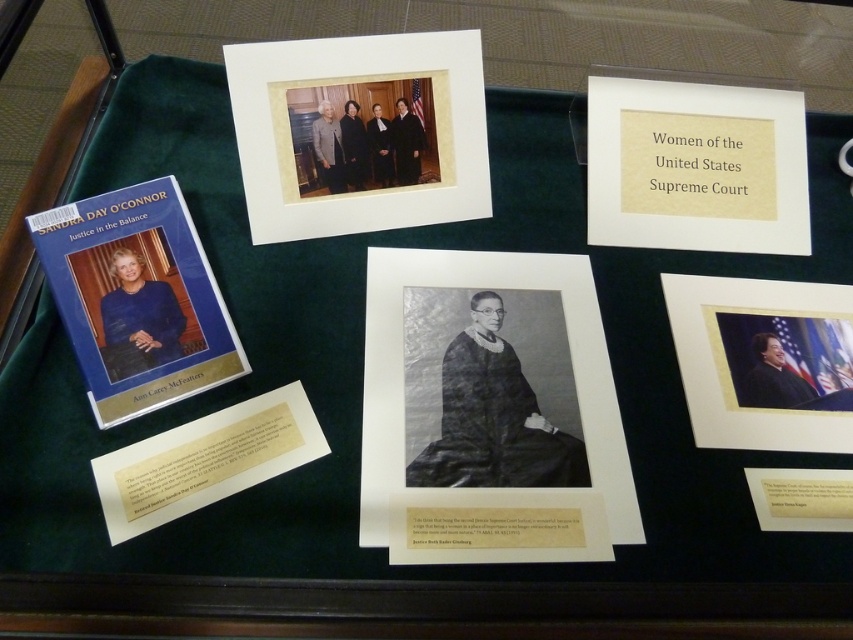
Which is in front, point (718, 230) or point (709, 380)?

Positioned in front is point (709, 380).

Based on the photo, can you confirm if beige paper at upper center is shorter than matte gold photo frame at lower right?

Incorrect, beige paper at upper center's height does not fall short of matte gold photo frame at lower right's.

Which is in front, point (735, 173) or point (782, 296)?

Point (782, 296) is in front.

Image resolution: width=853 pixels, height=640 pixels. I want to click on beige paper at upper center, so click(x=695, y=164).

You are a GUI agent. You are given a task and a screenshot of the screen. Output one action in this format:
    pyautogui.click(x=<x>, y=<y>)
    Task: Click on the black paper at center
    The image size is (853, 640).
    Given the screenshot: What is the action you would take?
    pyautogui.click(x=490, y=410)

Find the location of a particular element. This screenshot has width=853, height=640. black paper at center is located at coordinates (490, 410).

Based on the photo, does black paper at center come in front of matte gold photo frame at lower right?

Yes.

Identify the location of black paper at center. (490, 410).